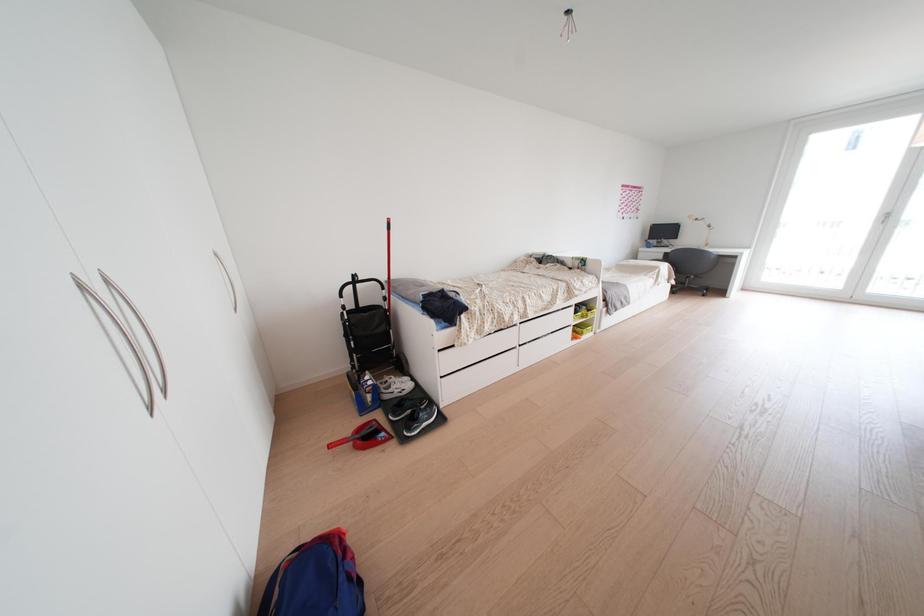
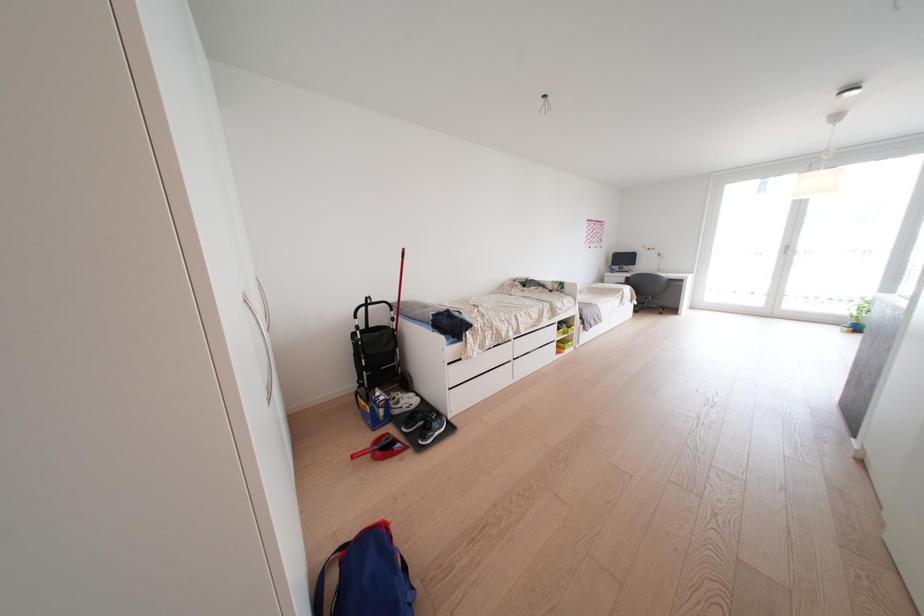
From the picture: What movement of the cameraman would produce the second image?

The movement direction of the cameraman is left, backward.